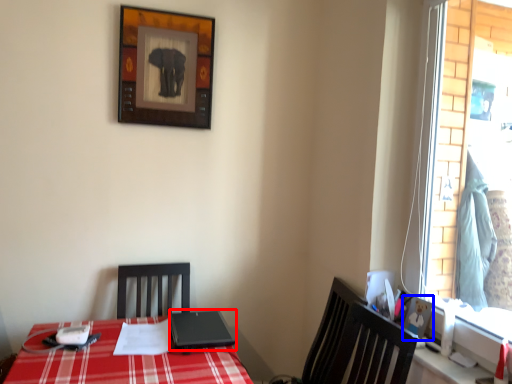
Question: Which object is further to the camera taking this photo, laptop (highlighted by a red box) or picture frame (highlighted by a blue box)?

Choices:
 (A) laptop
 (B) picture frame

Answer: (A)